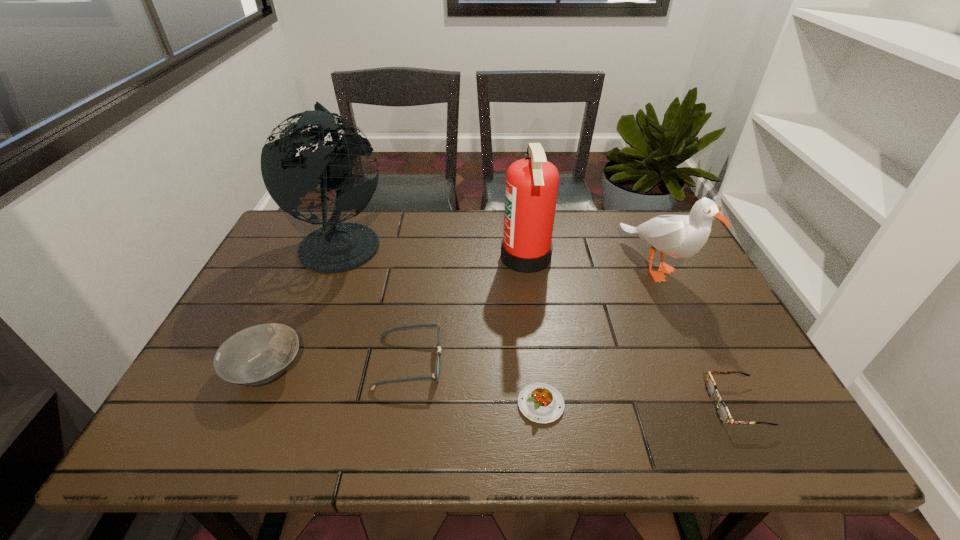
Identify the location of globe. (336, 247).

At what (x,y) coordinates should I click in order to perform the action: click on fire extinguisher. Please return your answer as a coordinate pair (x, y). Image resolution: width=960 pixels, height=540 pixels. Looking at the image, I should click on (531, 189).

Identify the location of the third tallest object. The image size is (960, 540). (680, 236).

You are a GUI agent. You are given a task and a screenshot of the screen. Output one action in this format:
    pyautogui.click(x=<x>, y=<y>)
    Task: Click on the bowl
    
    Given the screenshot: What is the action you would take?
    pyautogui.click(x=259, y=354)

This screenshot has height=540, width=960. I want to click on the left spectacles, so click(x=436, y=373).

This screenshot has height=540, width=960. Find the location of `the fifth tallest object`. the fifth tallest object is located at coordinates (436, 373).

Identify the location of the shorter spectacles. This screenshot has width=960, height=540. (723, 413).

You are a GUI agent. You are given a task and a screenshot of the screen. Output one action in this format:
    pyautogui.click(x=<x>, y=<y>)
    Task: Click on the pudding
    
    Given the screenshot: What is the action you would take?
    pyautogui.click(x=539, y=402)

Where is `free space located on the front-facing side of the globe`? This screenshot has height=540, width=960. free space located on the front-facing side of the globe is located at coordinates (461, 242).

Identify the location of blank space located at the nozzle of the fire extinguisher. The image size is (960, 540). (414, 257).